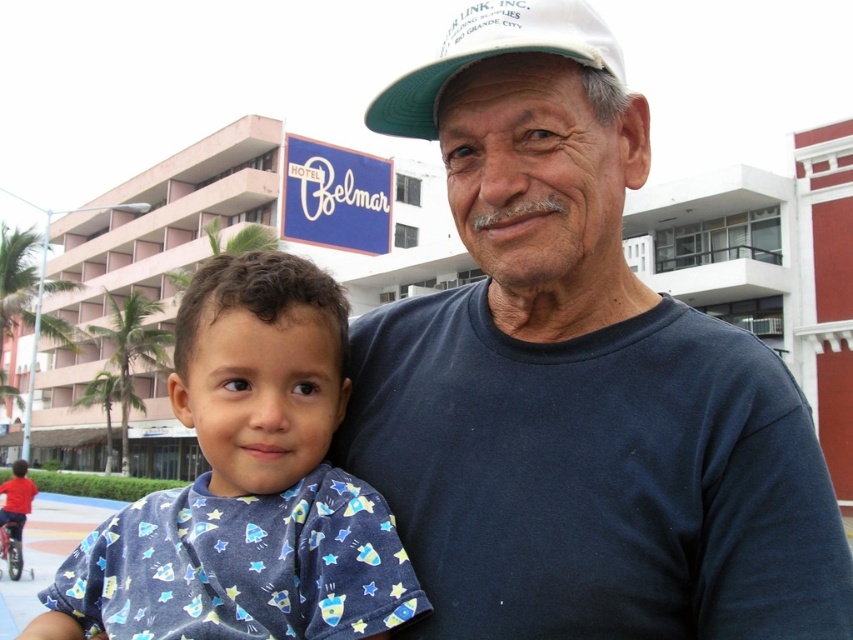
Question: From the image, what is the correct spatial relationship of dark blue t-shirt at center in relation to white fabric baseball cap at upper center?

Choices:
 (A) below
 (B) above

Answer: (A)

Question: Is dark blue t-shirt at center thinner than white fabric baseball cap at upper center?

Choices:
 (A) yes
 (B) no

Answer: (B)

Question: Which object appears farthest from the camera in this image?

Choices:
 (A) blue cotton shirt at lower left
 (B) dark blue t-shirt at center

Answer: (A)

Question: Which point is farther to the camera?

Choices:
 (A) blue cotton shirt at lower left
 (B) white fabric baseball cap at upper center

Answer: (B)

Question: Can you confirm if dark blue t-shirt at center is bigger than blue cotton shirt at lower left?

Choices:
 (A) yes
 (B) no

Answer: (A)

Question: Which point is closer to the camera taking this photo?

Choices:
 (A) (67, 589)
 (B) (718, 477)
 (C) (381, 120)

Answer: (B)